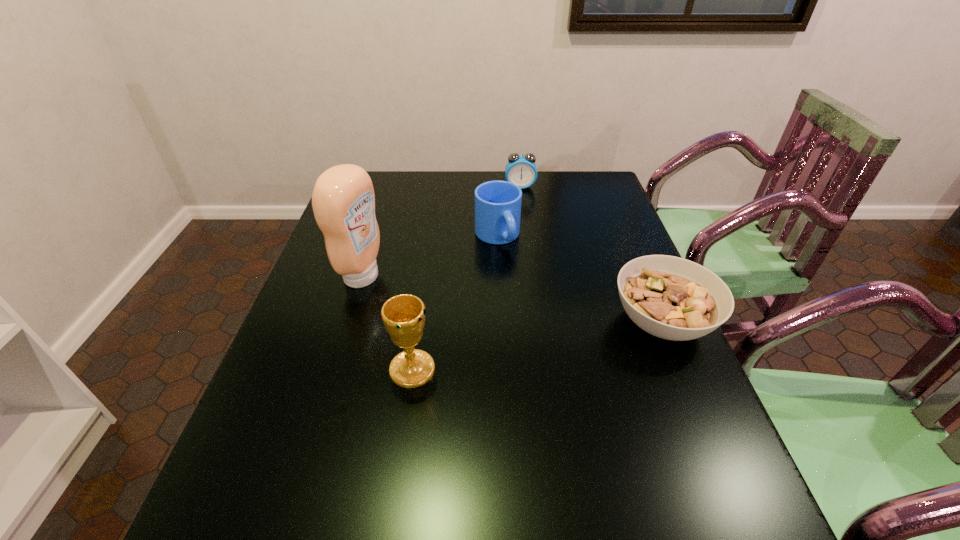
Where is `object that is at the right edge`? The height and width of the screenshot is (540, 960). object that is at the right edge is located at coordinates (672, 298).

Image resolution: width=960 pixels, height=540 pixels. I want to click on vacant space at the far edge, so click(x=442, y=181).

Image resolution: width=960 pixels, height=540 pixels. I want to click on free space at the near edge of the desktop, so click(x=478, y=478).

Locate an element on the screen. This screenshot has height=540, width=960. vacant area at the left edge of the desktop is located at coordinates (311, 299).

The height and width of the screenshot is (540, 960). In the image, there is a desktop. Find the location of `vacant region at the right edge`. vacant region at the right edge is located at coordinates (660, 416).

The height and width of the screenshot is (540, 960). I want to click on vacant region at the far left corner, so [381, 190].

Where is `blank space at the near left corner`? The width and height of the screenshot is (960, 540). blank space at the near left corner is located at coordinates (319, 437).

I want to click on vacant space that's between the second farthest object and the second tallest object, so click(455, 303).

At what (x,y) coordinates should I click in order to perform the action: click on free spot between the rightmost object and the condiment. Please return your answer as a coordinate pair (x, y). This screenshot has height=540, width=960. Looking at the image, I should click on (512, 300).

Locate an element on the screen. The height and width of the screenshot is (540, 960). empty location between the chalice and the fourth nearest object is located at coordinates (455, 303).